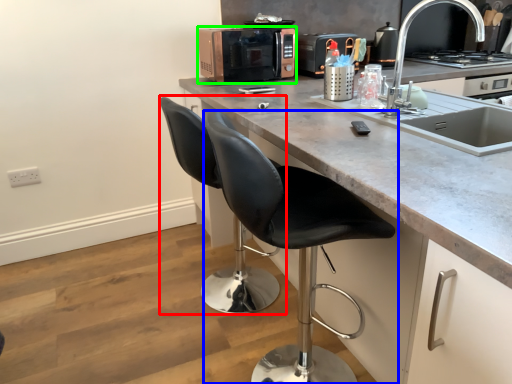
Question: Based on their relative distances, which object is farther from swivel chair (highlighted by a red box)? Choose from chair (highlighted by a blue box) and microwave oven (highlighted by a green box).

Choices:
 (A) chair
 (B) microwave oven

Answer: (B)